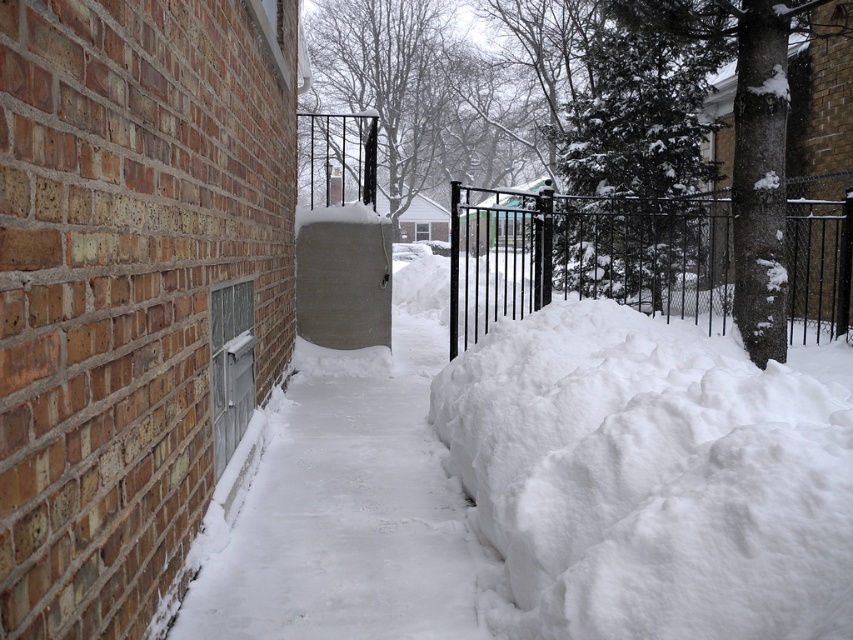
Does point (730, 451) come in front of point (364, 372)?

Yes, point (730, 451) is closer to viewer.

What do you see at coordinates (653, 477) in the screenshot? I see `white fluffy snow at right` at bounding box center [653, 477].

The image size is (853, 640). In order to click on white fluffy snow at right in this screenshot , I will do `click(653, 477)`.

Who is positioned more to the left, white snow at center or black wrought iron fence at center?

Positioned to the left is white snow at center.

Which is below, white snow at center or black wrought iron fence at center?

white snow at center is below.

Where is `white snow at center`? This screenshot has height=640, width=853. white snow at center is located at coordinates 350,500.

Identify the location of white snow at center. This screenshot has width=853, height=640. (350, 500).

Is the position of white fluffy snow at right more distant than that of black wrought iron fence at center?

That is False.

Between white fluffy snow at right and black wrought iron fence at center, which one has more height?

black wrought iron fence at center is taller.

Which is in front, point (576, 477) or point (811, 221)?

Positioned in front is point (576, 477).

What are the coordinates of `white fluffy snow at right` in the screenshot? It's located at (653, 477).